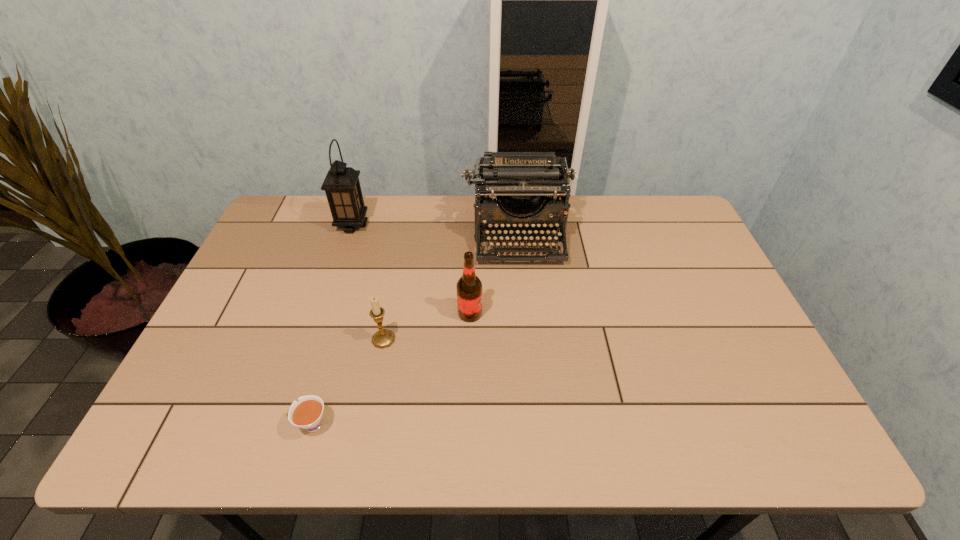
In the image, there is a desktop. Identify the location of free space at the right edge. (686, 330).

At what (x,y) coordinates should I click in order to perform the action: click on blank area at the far left corner. Please return your answer as a coordinate pair (x, y). The image size is (960, 540). Looking at the image, I should click on (289, 235).

Locate an element on the screen. The image size is (960, 540). vacant space at the near right corner of the desktop is located at coordinates (741, 442).

Find the location of `vacant point located between the second shortest object and the third nearest object`. vacant point located between the second shortest object and the third nearest object is located at coordinates (427, 326).

Find the location of a particular element. free space between the third object from left to right and the shortest object is located at coordinates (348, 382).

Find the location of a particular element. free spot between the shortest object and the second shortest object is located at coordinates (348, 382).

Locate an element on the screen. This screenshot has height=540, width=960. vacant area that lies between the nearest object and the tallest object is located at coordinates (332, 325).

Identify the location of vacant space that's between the root beer and the teacup. The width and height of the screenshot is (960, 540). (391, 369).

Find the location of a particular element. This screenshot has height=540, width=960. free spot between the third nearest object and the typewriter is located at coordinates (494, 274).

This screenshot has width=960, height=540. Identify the location of free space between the typewriter and the shortest object. (415, 330).